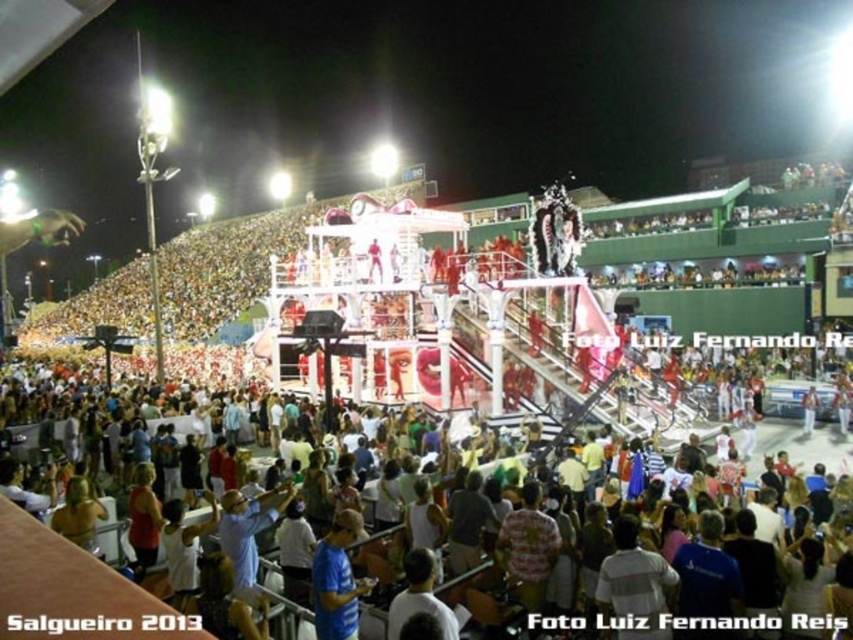
Does white cotton crowd at lower center have a lesser width compared to blue fabric shirt at lower center?

No.

Who is positioned more to the left, white cotton crowd at lower center or blue fabric shirt at lower center?

white cotton crowd at lower center

What do you see at coordinates (96, 438) in the screenshot? The width and height of the screenshot is (853, 640). I see `white cotton crowd at lower center` at bounding box center [96, 438].

Locate an element on the screen. white cotton crowd at lower center is located at coordinates (96, 438).